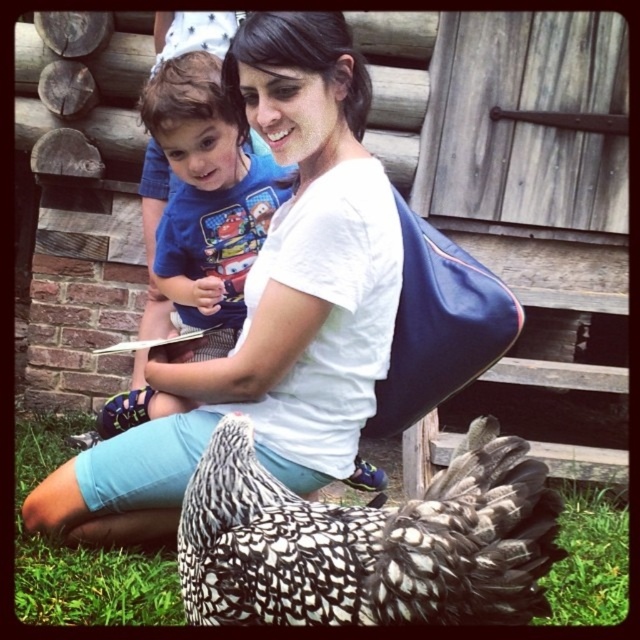
Question: Is white matte shirt at center bigger than black and white speckled feathered chicken at lower center?

Choices:
 (A) yes
 (B) no

Answer: (A)

Question: Which object is the closest to the white matte shirt at center?

Choices:
 (A) black and white speckled feathered chicken at lower center
 (B) blue cotton shirt at center

Answer: (B)

Question: Is white matte shirt at center to the left of black and white speckled feathered chicken at lower center from the viewer's perspective?

Choices:
 (A) yes
 (B) no

Answer: (A)

Question: Is white matte shirt at center further to camera compared to black and white speckled feathered chicken at lower center?

Choices:
 (A) no
 (B) yes

Answer: (B)

Question: Which object is the closest to the black and white speckled feathered chicken at lower center?

Choices:
 (A) white matte shirt at center
 (B) blue cotton shirt at center

Answer: (A)

Question: Which object appears farthest from the camera in this image?

Choices:
 (A) black and white speckled feathered chicken at lower center
 (B) white matte shirt at center
 (C) blue cotton shirt at center

Answer: (C)